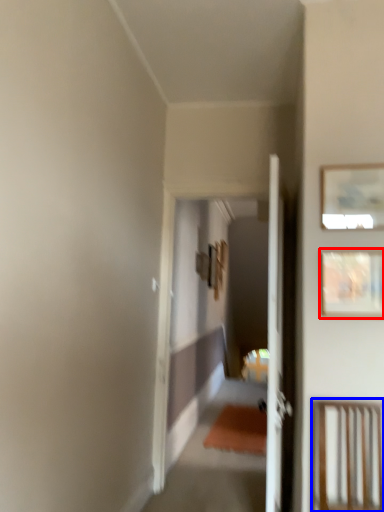
Question: Which of the following is the closest to the observer, picture frame (highlighted by a red box) or furniture (highlighted by a blue box)?

Choices:
 (A) picture frame
 (B) furniture

Answer: (B)